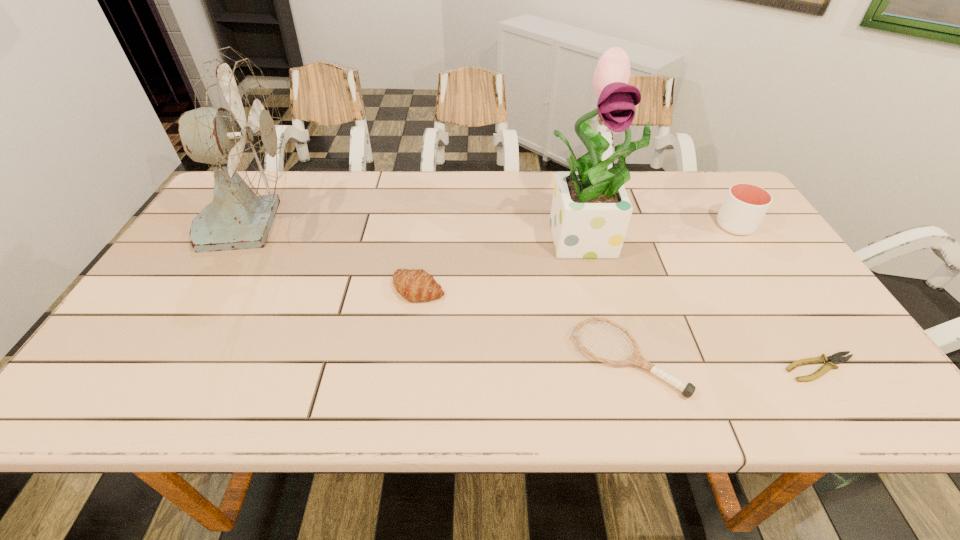
The width and height of the screenshot is (960, 540). I want to click on free region located on the front of the fourth farthest object, so click(x=408, y=369).

The width and height of the screenshot is (960, 540). I want to click on free space located 0.080m on the back of the fifth tallest object, so click(610, 296).

Locate an element on the screen. This screenshot has width=960, height=540. blank space located 0.280m on the back of the pliers is located at coordinates (756, 266).

Where is `fan situated at the far edge`? fan situated at the far edge is located at coordinates (236, 128).

You are a GUI agent. You are given a task and a screenshot of the screen. Output one action in this format:
    pyautogui.click(x=<x>, y=<y>)
    Task: Click on the flower arrangement that is at the far edge
    
    Given the screenshot: What is the action you would take?
    pyautogui.click(x=590, y=213)

At what (x,y) coordinates should I click in order to perform the action: click on cup present at the far edge. Please return your answer as a coordinate pair (x, y). The height and width of the screenshot is (540, 960). Looking at the image, I should click on (745, 205).

Identify the location of tennis racket that is at the near edge. (635, 358).

Where is `pliers present at the near edge`? This screenshot has width=960, height=540. pliers present at the near edge is located at coordinates (836, 358).

This screenshot has width=960, height=540. I want to click on object positioned at the left edge, so click(236, 128).

Locate an element on the screen. cup that is at the right edge is located at coordinates (745, 205).